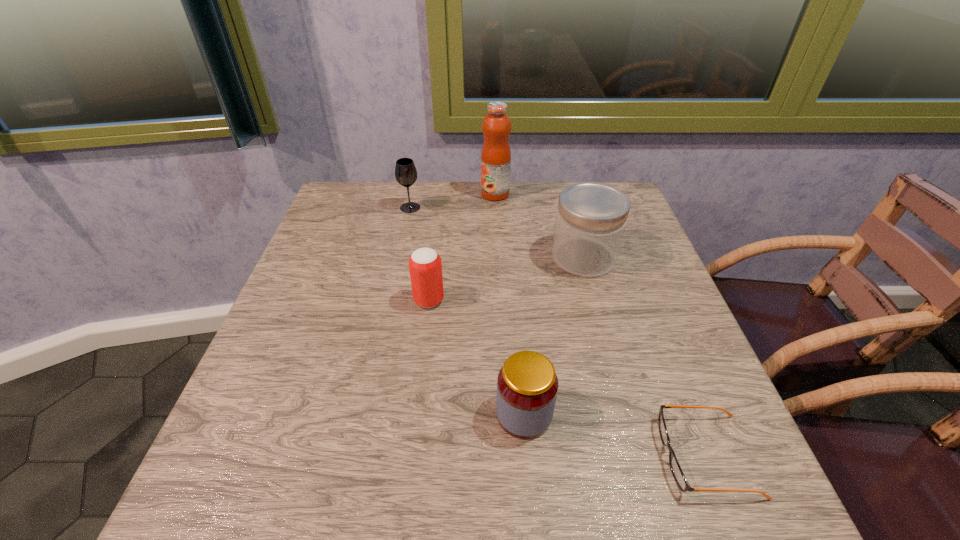
In order to click on vacant space located 0.400m on the front-facing side of the shortest object in this screenshot , I will do `click(406, 455)`.

The width and height of the screenshot is (960, 540). In order to click on fruit juice present at the far edge in this screenshot , I will do `click(496, 155)`.

Locate an element on the screen. The width and height of the screenshot is (960, 540). wineglass that is at the far edge is located at coordinates (405, 171).

I want to click on object that is at the near edge, so click(x=677, y=472).

Where is `jar present at the right edge`? The height and width of the screenshot is (540, 960). jar present at the right edge is located at coordinates (591, 217).

The width and height of the screenshot is (960, 540). What are the coordinates of `spectacles that is positioned at the right edge` in the screenshot? It's located at (677, 472).

Find the location of a particular element. This screenshot has height=540, width=960. object present at the near right corner is located at coordinates (677, 472).

Where is `vacant position at the far edge of the desktop`? vacant position at the far edge of the desktop is located at coordinates (475, 228).

In the image, there is a desktop. In order to click on free space at the near edge in this screenshot , I will do `click(522, 520)`.

The width and height of the screenshot is (960, 540). I want to click on vacant space at the left edge, so click(301, 325).